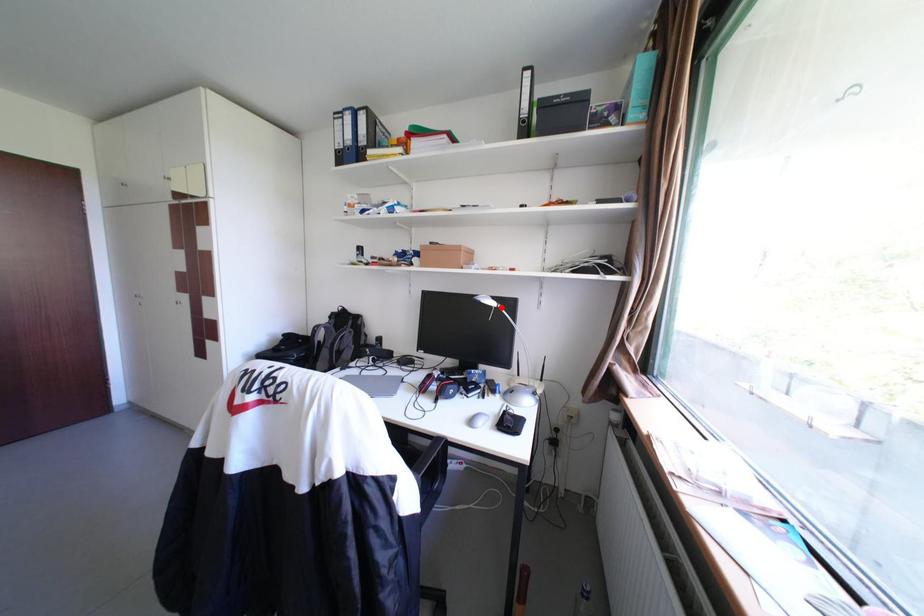
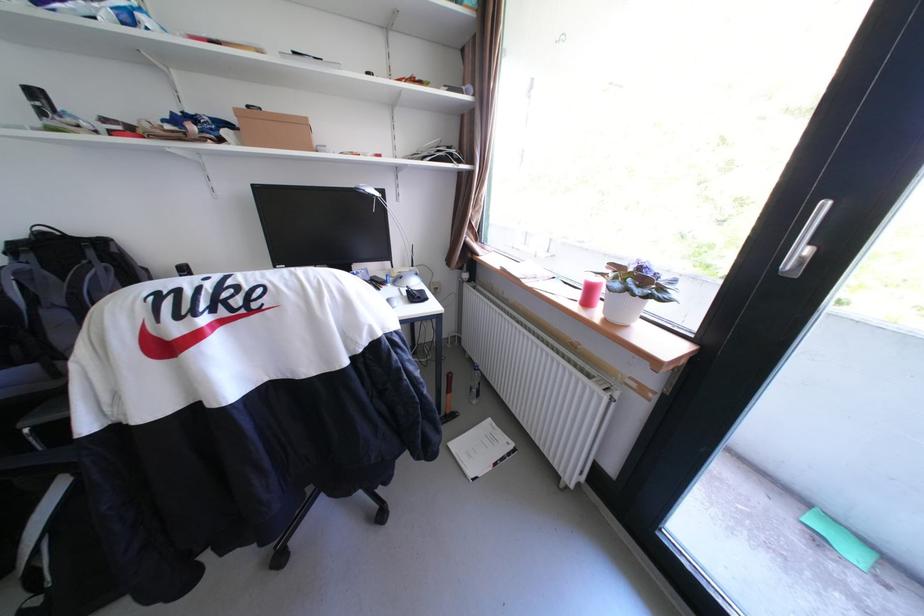
Where in the second image is the point corresponding to the highlighted location from the first image?

(382, 198)